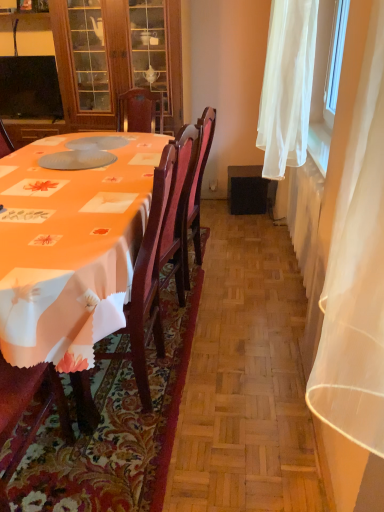
Question: Would you say matte wood cabinet at upper left is to the left or to the right of wooden chair at left in the picture?

Choices:
 (A) left
 (B) right

Answer: (A)

Question: Is point (57, 31) closer or farther from the camera than point (145, 315)?

Choices:
 (A) closer
 (B) farther

Answer: (B)

Question: Which object is the closest to the orange fabric tablecloth at center?

Choices:
 (A) wooden chair at left
 (B) black glossy television at upper left
 (C) matte wood cabinet at upper left
 (D) white sheer curtain at right

Answer: (A)

Question: Estimate the real-world distances between objects in this image. Which object is farther from the black glossy television at upper left?

Choices:
 (A) matte wood cabinet at upper left
 (B) white sheer curtain at right
 (C) wooden chair at left
 (D) orange fabric tablecloth at center

Answer: (D)